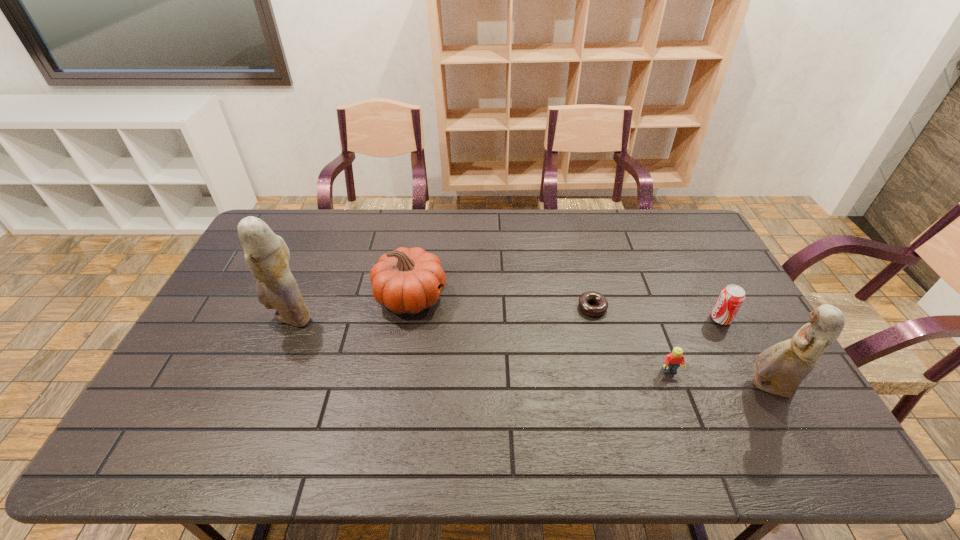
The width and height of the screenshot is (960, 540). In order to click on the taller figurine in this screenshot , I will do `click(266, 254)`.

Locate an element on the screen. the leftmost object is located at coordinates (266, 254).

At what (x,y) coordinates should I click in order to perform the action: click on the right figurine. Please return your answer as a coordinate pair (x, y). The image size is (960, 540). Looking at the image, I should click on (780, 369).

Where is `the shorter figurine`? the shorter figurine is located at coordinates (780, 369).

Locate an element on the screen. Image resolution: width=960 pixels, height=540 pixels. the shortest object is located at coordinates (602, 304).

This screenshot has width=960, height=540. In order to click on the fourth object from right to left in this screenshot , I will do `click(602, 304)`.

Locate an element on the screen. Image resolution: width=960 pixels, height=540 pixels. the third tallest object is located at coordinates (407, 280).

Image resolution: width=960 pixels, height=540 pixels. What are the coordinates of `pumpkin` in the screenshot? It's located at (407, 280).

In order to click on soda can in this screenshot , I will do `click(731, 298)`.

At what (x,y) coordinates should I click in order to perform the action: click on the third object from right to left. Please return your answer as a coordinate pair (x, y). The height and width of the screenshot is (540, 960). Looking at the image, I should click on (672, 361).